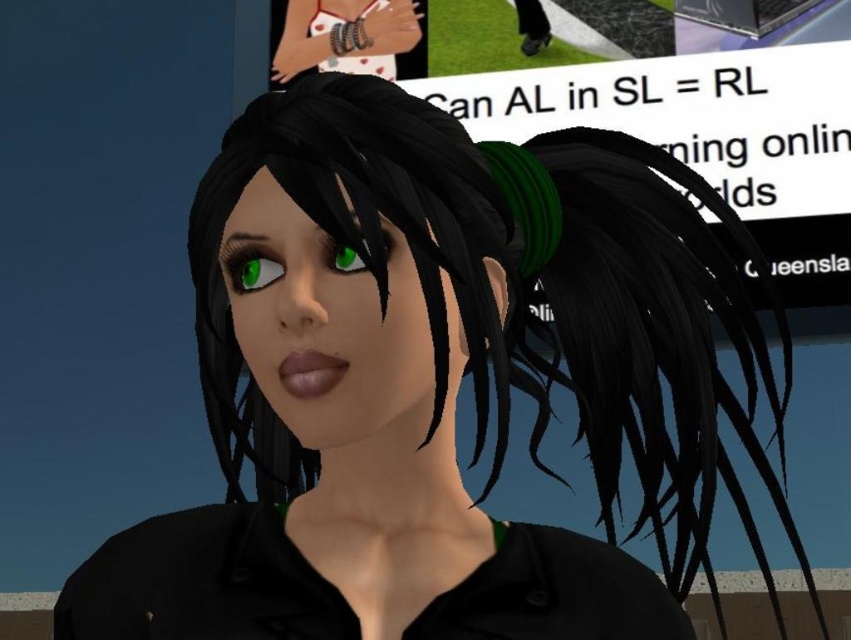
From the picture: Can you confirm if green rubber hairband at right is smaller than green matte eye at center?

Incorrect, green rubber hairband at right is not smaller in size than green matte eye at center.

Is the position of green rubber hairband at right more distant than that of green matte eye at center?

Yes.

Identify the location of green rubber hairband at right. The height and width of the screenshot is (640, 851). (606, 141).

At what (x,y) coordinates should I click in order to perform the action: click on green rubber hairband at right. Please return your answer as a coordinate pair (x, y). Image resolution: width=851 pixels, height=640 pixels. Looking at the image, I should click on (606, 141).

Is point (781, 627) positioned behind point (273, 276)?

That is True.

The height and width of the screenshot is (640, 851). What do you see at coordinates (606, 141) in the screenshot?
I see `green rubber hairband at right` at bounding box center [606, 141].

Who is more distant from viewer, [541,138] or [269,259]?

Positioned behind is point [541,138].

You are a GUI agent. You are given a task and a screenshot of the screen. Output one action in this format:
    pyautogui.click(x=<x>, y=<y>)
    Task: Click on the green rubber hairband at right
    Image resolution: width=851 pixels, height=640 pixels.
    Given the screenshot: What is the action you would take?
    pyautogui.click(x=606, y=141)

Is the position of green matte eye at upper left more distant than that of green matte eye at center?

That is True.

Between green matte eye at upper left and green matte eye at center, which one is positioned higher?

green matte eye at center

This screenshot has height=640, width=851. Find the location of `green matte eye at upper left`. green matte eye at upper left is located at coordinates (250, 264).